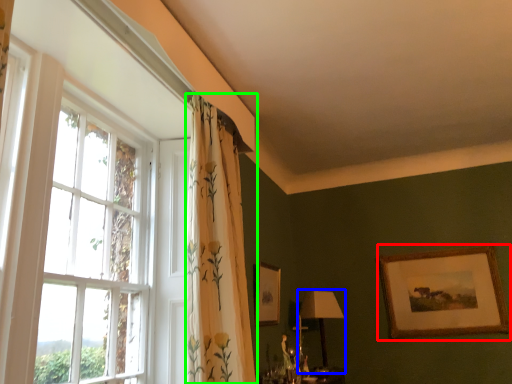
Question: Which is farther away from picture frame (highlighted by a red box)? table lamp (highlighted by a blue box) or curtain (highlighted by a green box)?

Choices:
 (A) table lamp
 (B) curtain

Answer: (B)